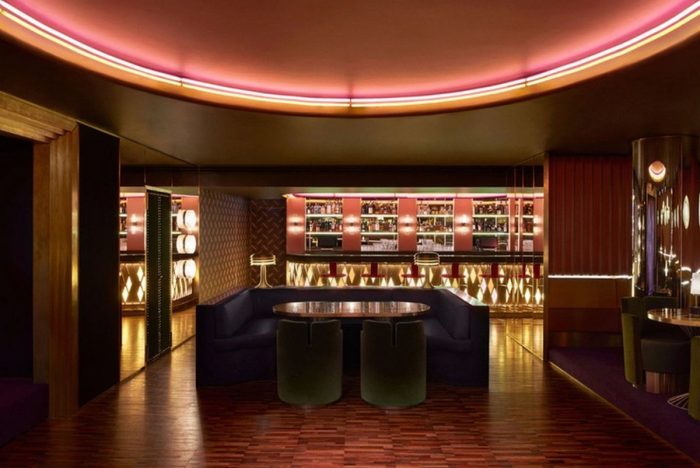
This screenshot has height=468, width=700. Find the location of `floor reflection`. floor reflection is located at coordinates tap(136, 407), tap(182, 383).